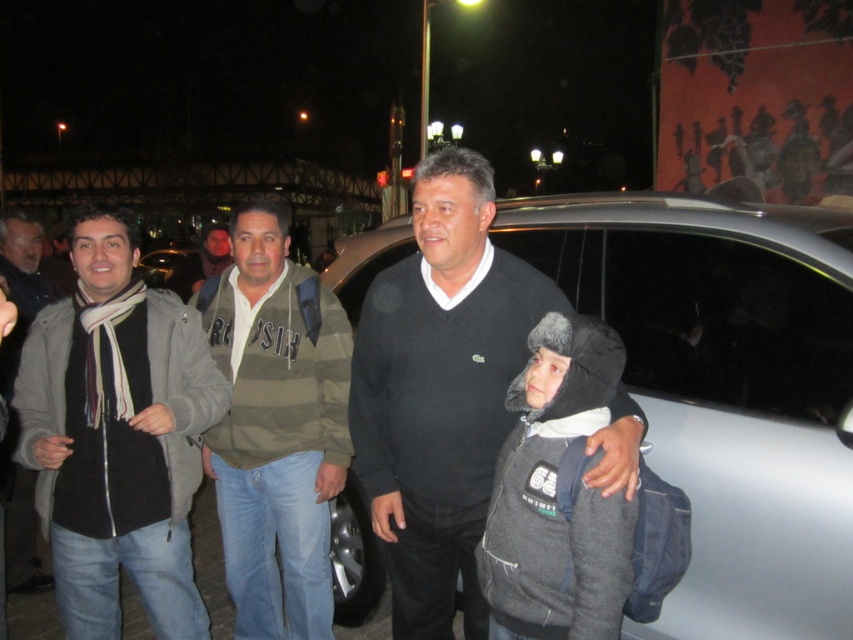
You are trying to decide which item to take for a cold night. You see the dark gray fleece jacket at center and the black wool scarf at left. Which item is narrower in width?

The dark gray fleece jacket at center is thinner than the black wool scarf at left, so the jacket is narrower in width.